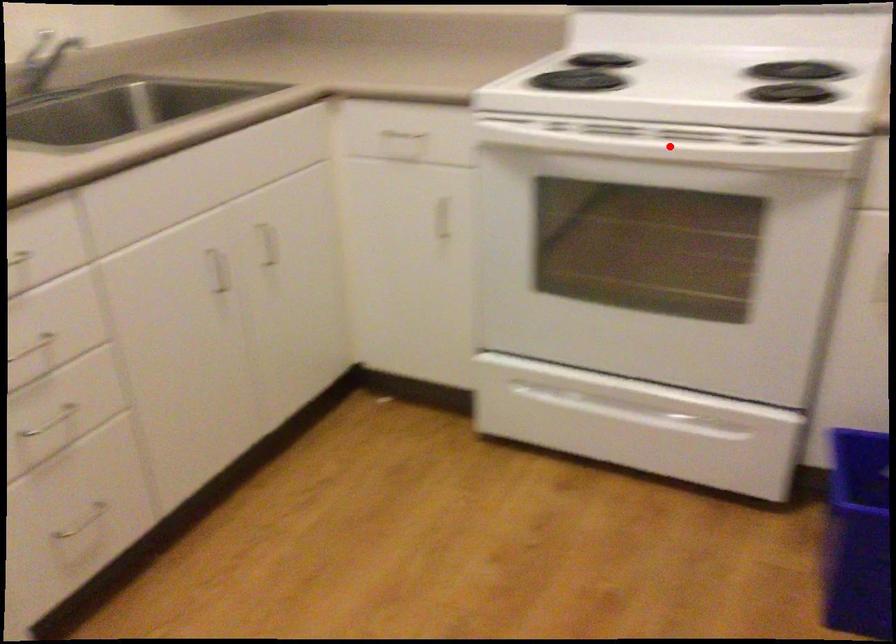
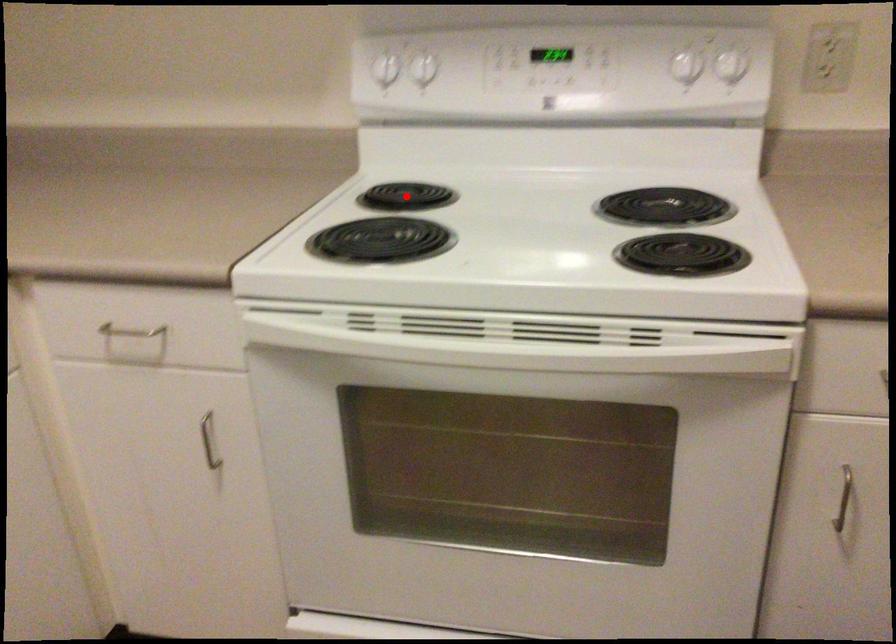
I am providing you with two images of the same scene from different viewpoints. A red point is marked on the first image and another point is marked on the second image. Does the point marked in image1 correspond to the same location as the one in image2?

No